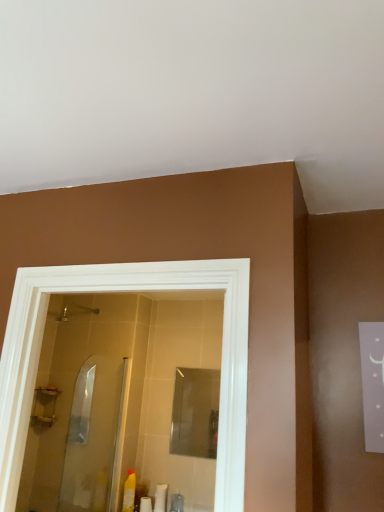
I want to click on brushed metal shower at upper left, so click(x=73, y=312).

This screenshot has height=512, width=384. Describe the element at coordinates (96, 436) in the screenshot. I see `clear glass shower door at center` at that location.

What is the approximate width of clear glass shower door at center?

It is 1.17 inches.

What do you see at coordinates (129, 492) in the screenshot?
I see `yellow plastic bottle at lower left, which is the third toiletry from right to left` at bounding box center [129, 492].

This screenshot has width=384, height=512. I want to click on brushed metal shower at upper left, so click(x=73, y=312).

Considering the relative sizes of translucent plastic bottle at lower center, the first toiletry from the right, and white matte tube at lower center, the 2th toiletry positioned from the left, in the image provided, is translucent plastic bottle at lower center, the first toiletry from the right, shorter than white matte tube at lower center, the 2th toiletry positioned from the left,?

Yes, translucent plastic bottle at lower center, the first toiletry from the right, is shorter than white matte tube at lower center, the 2th toiletry positioned from the left.

Based on the photo, is translucent plastic bottle at lower center, the first toiletry from the right, bigger or smaller than white matte tube at lower center, the second toiletry in the right-to-left sequence?

Clearly, translucent plastic bottle at lower center, the first toiletry from the right, is larger in size than white matte tube at lower center, the second toiletry in the right-to-left sequence.

Is point (179, 496) positioned in front of point (159, 490)?

Yes.

Is translucent plastic bottle at lower center, the first toiletry from the right, not close to white matte tube at lower center, the 2th toiletry positioned from the left?

No.

From the image's perspective, is translucent plastic bottle at lower center, which is the third toiletry in left-to-right order, above brushed metal shower at upper left?

No, from the image's perspective, translucent plastic bottle at lower center, which is the third toiletry in left-to-right order, is not over brushed metal shower at upper left.

Who is shorter, translucent plastic bottle at lower center, the first toiletry from the right, or brushed metal shower at upper left?

Standing shorter between the two is brushed metal shower at upper left.

Can you confirm if translucent plastic bottle at lower center, the first toiletry from the right, is thinner than brushed metal shower at upper left?

Yes, translucent plastic bottle at lower center, the first toiletry from the right, is thinner than brushed metal shower at upper left.

Considering the relative positions of white matte tube at lower center, the second toiletry in the right-to-left sequence, and translucent plastic bottle at lower center, the first toiletry from the right, in the image provided, is white matte tube at lower center, the second toiletry in the right-to-left sequence, to the left of translucent plastic bottle at lower center, the first toiletry from the right, from the viewer's perspective?

Yes.

Could translucent plastic bottle at lower center, the first toiletry from the right, be considered to be inside white matte tube at lower center, the 2th toiletry positioned from the left?

No, white matte tube at lower center, the 2th toiletry positioned from the left, does not contain translucent plastic bottle at lower center, the first toiletry from the right.

Does white matte tube at lower center, the 2th toiletry positioned from the left, have a greater height compared to translucent plastic bottle at lower center, which is the third toiletry in left-to-right order?

Correct, white matte tube at lower center, the 2th toiletry positioned from the left, is much taller as translucent plastic bottle at lower center, which is the third toiletry in left-to-right order.

Does white matte tube at lower center, the 2th toiletry positioned from the left, have a lesser width compared to translucent plastic bottle at lower center, which is the third toiletry in left-to-right order?

Yes.

Looking at their sizes, would you say white matte tube at lower center, the second toiletry in the right-to-left sequence, is wider or thinner than brushed metal shower at upper left?

white matte tube at lower center, the second toiletry in the right-to-left sequence, is thinner than brushed metal shower at upper left.

Is white matte tube at lower center, the second toiletry in the right-to-left sequence, next to brushed metal shower at upper left and touching it?

There is a gap between white matte tube at lower center, the second toiletry in the right-to-left sequence, and brushed metal shower at upper left.

Which is more to the right, white matte tube at lower center, the second toiletry in the right-to-left sequence, or brushed metal shower at upper left?

white matte tube at lower center, the second toiletry in the right-to-left sequence, is more to the right.

Is point (165, 509) more distant than point (85, 314)?

No, it is in front of (85, 314).

Is translucent plastic bottle at lower center, the first toiletry from the right, spatially inside yellow plastic bottle at lower left, which is the first toiletry from left to right, or outside of it?

translucent plastic bottle at lower center, the first toiletry from the right, is not inside yellow plastic bottle at lower left, which is the first toiletry from left to right, it's outside.

From the image's perspective, between translucent plastic bottle at lower center, the first toiletry from the right, and yellow plastic bottle at lower left, which is the first toiletry from left to right, who is located below?

translucent plastic bottle at lower center, the first toiletry from the right.

I want to click on toiletry that appears above the translucent plastic bottle at lower center, which is the third toiletry in left-to-right order (from a real-world perspective), so 129,492.

Which is more to the right, translucent plastic bottle at lower center, the first toiletry from the right, or yellow plastic bottle at lower left, which is the first toiletry from left to right?

translucent plastic bottle at lower center, the first toiletry from the right.

Is brushed metal shower at upper left far from clear glass shower door at center?

No, brushed metal shower at upper left is in close proximity to clear glass shower door at center.

From the image's perspective, is brushed metal shower at upper left positioned above or below clear glass shower door at center?

From the image's perspective, brushed metal shower at upper left appears above clear glass shower door at center.

From a real-world perspective, is brushed metal shower at upper left above or below clear glass shower door at center?

brushed metal shower at upper left is above clear glass shower door at center.

Which is in front, point (95, 314) or point (84, 502)?

The point (84, 502) is more forward.

Considering the relative positions of translucent plastic bottle at lower center, which is the third toiletry in left-to-right order, and clear glass shower door at center in the image provided, is translucent plastic bottle at lower center, which is the third toiletry in left-to-right order, to the left of clear glass shower door at center from the viewer's perspective?

In fact, translucent plastic bottle at lower center, which is the third toiletry in left-to-right order, is to the right of clear glass shower door at center.

Is clear glass shower door at center surrounded by translucent plastic bottle at lower center, the first toiletry from the right?

No, clear glass shower door at center is located outside of translucent plastic bottle at lower center, the first toiletry from the right.

Looking at this image, is translucent plastic bottle at lower center, the first toiletry from the right, smaller than clear glass shower door at center?

Correct, translucent plastic bottle at lower center, the first toiletry from the right, occupies less space than clear glass shower door at center.

Locate an element on the screen. Image resolution: width=384 pixels, height=512 pixels. toiletry that is the 1st one when counting forward from the white matte tube at lower center, the second toiletry in the right-to-left sequence is located at coordinates (177, 503).

Identify the location of shower behind the translucent plastic bottle at lower center, the first toiletry from the right. The image size is (384, 512). (73, 312).

When comparing their distances from translucent plastic bottle at lower center, which is the third toiletry in left-to-right order, does yellow plastic bottle at lower left, which is the first toiletry from left to right, or white matte tube at lower center, the second toiletry in the right-to-left sequence, seem further?

The object further to translucent plastic bottle at lower center, which is the third toiletry in left-to-right order, is yellow plastic bottle at lower left, which is the first toiletry from left to right.

In the scene shown: Estimate the real-world distances between objects in this image. Which object is further from translucent plastic bottle at lower center, the first toiletry from the right, yellow plastic bottle at lower left, which is the third toiletry from right to left, or clear glass shower door at center?

clear glass shower door at center is further to translucent plastic bottle at lower center, the first toiletry from the right.

Considering their positions, is translucent plastic bottle at lower center, which is the third toiletry in left-to-right order, positioned further to clear glass shower door at center than brushed metal shower at upper left?

The object further to clear glass shower door at center is brushed metal shower at upper left.

When comparing their distances from brushed metal shower at upper left, does translucent plastic bottle at lower center, which is the third toiletry in left-to-right order, or yellow plastic bottle at lower left, which is the third toiletry from right to left, seem further?

Among the two, translucent plastic bottle at lower center, which is the third toiletry in left-to-right order, is located further to brushed metal shower at upper left.

Based on their spatial positions, is brushed metal shower at upper left or translucent plastic bottle at lower center, which is the third toiletry in left-to-right order, closer to clear glass shower door at center?

translucent plastic bottle at lower center, which is the third toiletry in left-to-right order, is closer to clear glass shower door at center.

Which object lies nearer to the anchor point yellow plastic bottle at lower left, which is the first toiletry from left to right, clear glass shower door at center or brushed metal shower at upper left?

The object closer to yellow plastic bottle at lower left, which is the first toiletry from left to right, is clear glass shower door at center.

Based on the photo, considering their positions, is brushed metal shower at upper left positioned closer to yellow plastic bottle at lower left, which is the first toiletry from left to right, than translucent plastic bottle at lower center, which is the third toiletry in left-to-right order?

Among the two, translucent plastic bottle at lower center, which is the third toiletry in left-to-right order, is located nearer to yellow plastic bottle at lower left, which is the first toiletry from left to right.

From the image, which object appears to be farther from clear glass shower door at center, white matte tube at lower center, the second toiletry in the right-to-left sequence, or yellow plastic bottle at lower left, which is the third toiletry from right to left?

white matte tube at lower center, the second toiletry in the right-to-left sequence, lies further to clear glass shower door at center than the other object.

Find the location of `screen door between brushed metal shower at upper left and white matte tube at lower center, the second toiletry in the right-to-left sequence, in the up-down direction`. screen door between brushed metal shower at upper left and white matte tube at lower center, the second toiletry in the right-to-left sequence, in the up-down direction is located at coordinates (96, 436).

At what (x,y) coordinates should I click in order to perform the action: click on toiletry between clear glass shower door at center and translucent plastic bottle at lower center, which is the third toiletry in left-to-right order, from front to back. Please return your answer as a coordinate pair (x, y). Image resolution: width=384 pixels, height=512 pixels. Looking at the image, I should click on (129, 492).

Where is `toiletry located between yellow plastic bottle at lower left, which is the first toiletry from left to right, and translucent plastic bottle at lower center, the first toiletry from the right, in the left-right direction`? This screenshot has width=384, height=512. toiletry located between yellow plastic bottle at lower left, which is the first toiletry from left to right, and translucent plastic bottle at lower center, the first toiletry from the right, in the left-right direction is located at coordinates (161, 498).

The height and width of the screenshot is (512, 384). I want to click on toiletry between brushed metal shower at upper left and white matte tube at lower center, the second toiletry in the right-to-left sequence, from top to bottom, so click(129, 492).